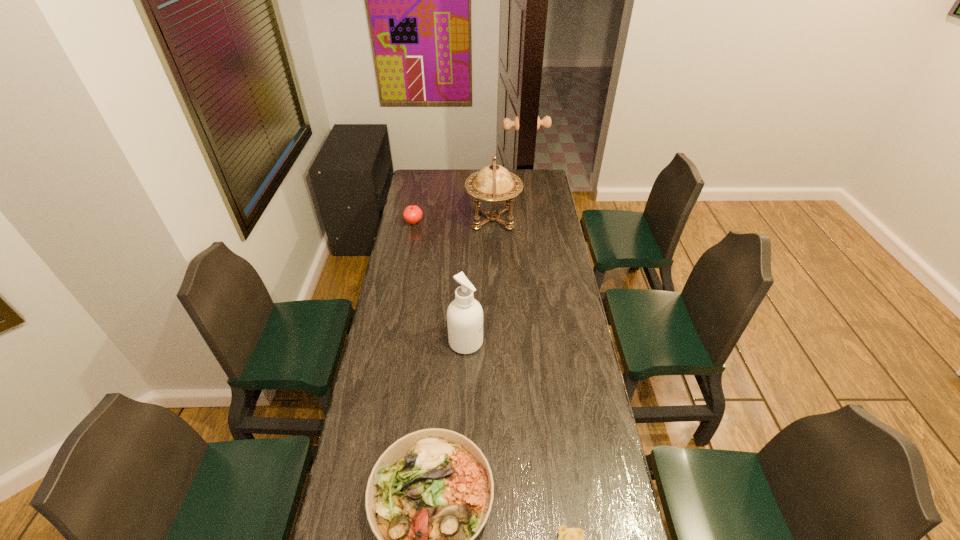
Find the location of `free space at the right edge of the desktop`. free space at the right edge of the desktop is located at coordinates (584, 373).

Find the location of a particular element. Image resolution: width=960 pixels, height=540 pixels. free space at the far right corner of the desktop is located at coordinates (543, 178).

Find the location of `free area in between the globe and the apple`. free area in between the globe and the apple is located at coordinates (453, 221).

In order to click on vacant space that's between the globe and the cleansing agent in this screenshot , I will do `click(479, 281)`.

This screenshot has width=960, height=540. Identify the location of free point between the globe and the apple. pyautogui.click(x=453, y=221).

Identify the location of free spot between the apple and the third farthest object. The image size is (960, 540). (440, 282).

You are a GUI agent. You are given a task and a screenshot of the screen. Output one action in this format:
    pyautogui.click(x=<x>, y=<y>)
    Task: Click on the object identified as the second closest to the apple
    Image resolution: width=960 pixels, height=540 pixels.
    Given the screenshot: What is the action you would take?
    pyautogui.click(x=464, y=315)

Locate an element on the screen. the closest object to the apple is located at coordinates [493, 184].